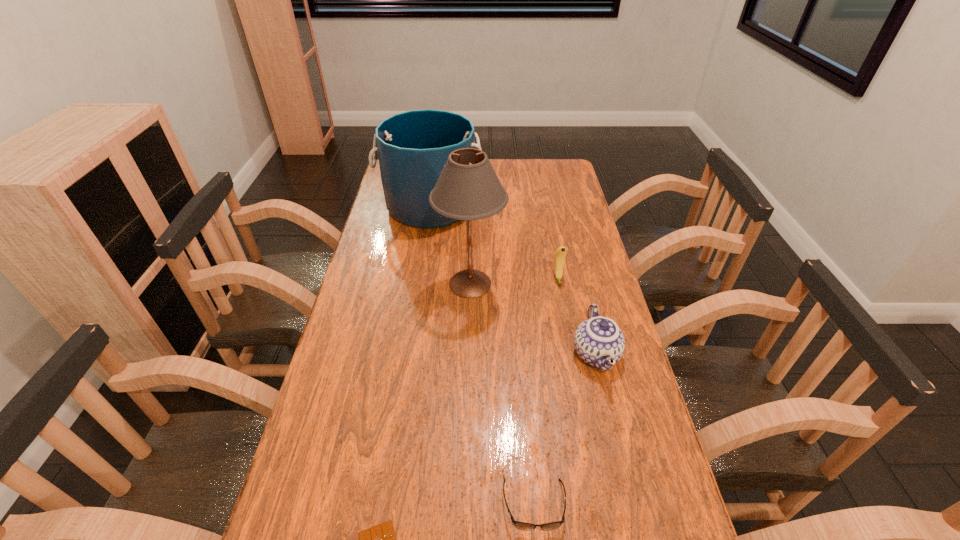
I want to click on the tallest object, so click(468, 188).

At what (x,y) coordinates should I click in order to perform the action: click on bucket. Please return your answer as a coordinate pair (x, y). Looking at the image, I should click on (413, 147).

I want to click on the farthest object, so click(x=413, y=147).

Where is `banana`? Image resolution: width=960 pixels, height=540 pixels. banana is located at coordinates (560, 253).

This screenshot has height=540, width=960. Find the location of `the fourth farthest object`. the fourth farthest object is located at coordinates (599, 341).

Find the location of a particular element. The image size is (960, 540). sunglasses is located at coordinates (519, 525).

Where is `vacant space located 0.100m on the front-facing side of the table lamp`? Image resolution: width=960 pixels, height=540 pixels. vacant space located 0.100m on the front-facing side of the table lamp is located at coordinates (536, 284).

You are a GUI agent. You are given a task and a screenshot of the screen. Output one action in this format:
    pyautogui.click(x=<x>, y=<y>)
    Task: Click on the vacant space located 0.210m on the back of the bucket
    
    Given the screenshot: What is the action you would take?
    pyautogui.click(x=438, y=160)

You are a GUI agent. You are given a task and a screenshot of the screen. Output one action in this format:
    pyautogui.click(x=<x>, y=<y>)
    Task: Click on the vacant region located 0.250m from the stem of the banana
    The height and width of the screenshot is (540, 960).
    Given the screenshot: What is the action you would take?
    [572, 348]

The width and height of the screenshot is (960, 540). I want to click on free space located from the spout of the chinaware, so click(x=640, y=535).